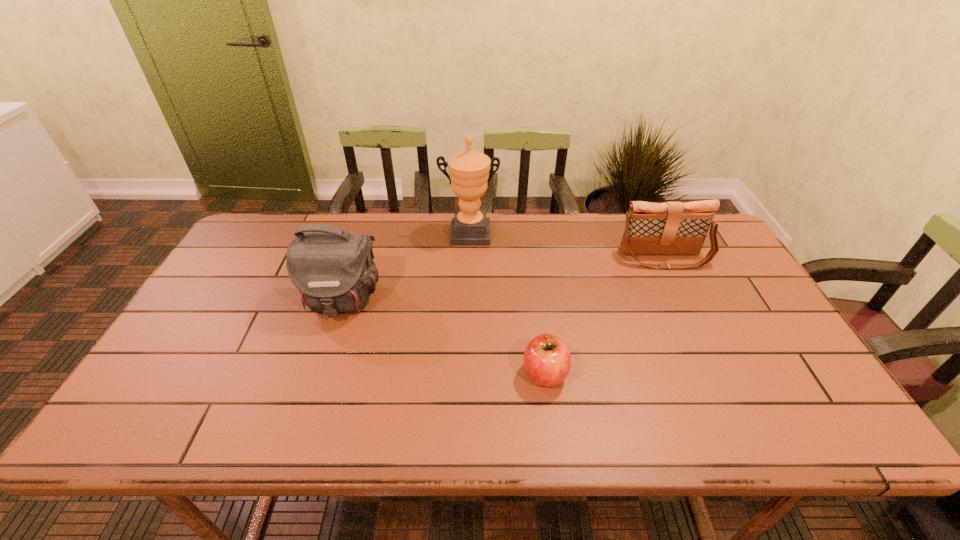
Image resolution: width=960 pixels, height=540 pixels. I want to click on blank space at the far left corner of the desktop, so click(x=269, y=242).

Identify the location of vacant space at the near left corner. (158, 431).

At what (x,y) coordinates should I click in order to perform the action: click on unoccupied position between the left shoulder bag and the nearest object. Please return your answer as a coordinate pair (x, y). The width and height of the screenshot is (960, 540). Looking at the image, I should click on (443, 337).

Image resolution: width=960 pixels, height=540 pixels. I want to click on unoccupied position between the taller shoulder bag and the farthest object, so click(x=405, y=267).

This screenshot has height=540, width=960. What are the coordinates of `free space between the taller shoulder bag and the shorter shoulder bag` in the screenshot? It's located at (502, 279).

Where is `vacant area that lies between the leftmost object and the award`? The image size is (960, 540). vacant area that lies between the leftmost object and the award is located at coordinates (405, 267).

You are a GUI agent. You are given a task and a screenshot of the screen. Output one action in this format:
    pyautogui.click(x=<x>, y=<y>)
    Task: Click on the free point between the second farthest object and the tallest object
    This screenshot has height=540, width=960.
    Given the screenshot: What is the action you would take?
    point(566,246)

Locate an element on the screen. The width and height of the screenshot is (960, 540). vacant area that lies between the second object from right to left and the tallest object is located at coordinates (507, 303).

The image size is (960, 540). Identify the location of empty space between the rightmost object and the nearest object. (604, 316).

Image resolution: width=960 pixels, height=540 pixels. In order to click on free space that is in between the rightmost object and the shortest object in this screenshot , I will do `click(604, 316)`.